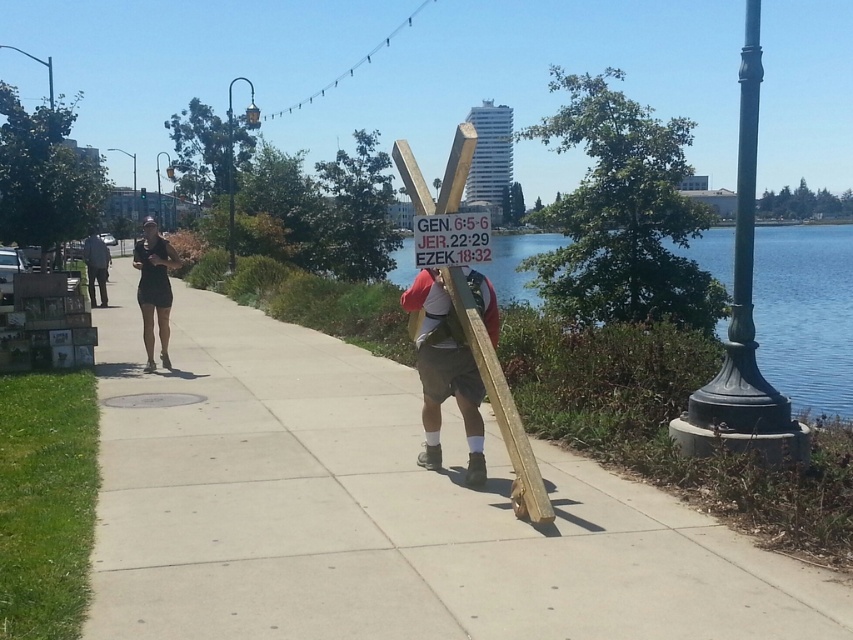
You are standing on the waterfront promenade and want to read the text on the wooden sign at center. The matte black dress at center is blocking your view. Can you step around the dress to see the sign?

The wooden sign at center is closer to the viewer than the matte black dress at center, so you can step around the matte black dress at center to see the wooden sign at center since it is in front of the dress.

You are a pedestrian standing on the sidewalk. You see a white plastic sign at center and dark gray pants at center. Which object is taller?

The dark gray pants at center are taller than the white plastic sign at center.

You are a photographer standing on the waterfront promenade. You want to take a photo of the matte black dress at center and the white plastic sign at center. If you want to ensure both objects are fully visible in your frame, which object should you position closer to the camera?

Since the matte black dress at center is wider than the white plastic sign at center, you should position the matte black dress at center closer to the camera to ensure both are fully visible in the frame.